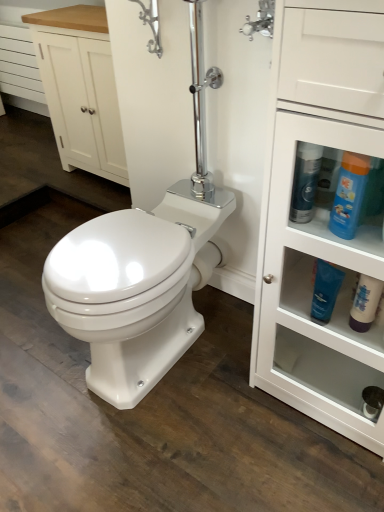
You are a GUI agent. You are given a task and a screenshot of the screen. Output one action in this format:
    pyautogui.click(x=<x>, y=<y>)
    Task: Click on the blank area beneath white wood drawer at upper left (from a real-world perspective)
    The image size is (384, 512).
    Given the screenshot: What is the action you would take?
    pyautogui.click(x=23, y=116)